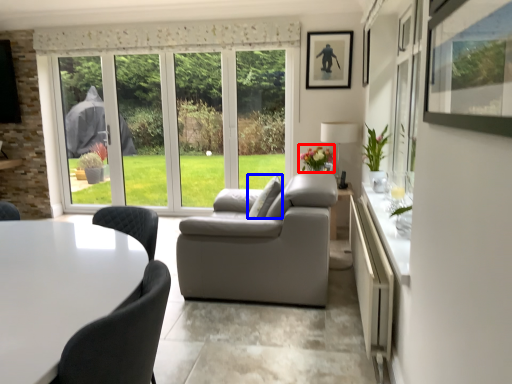
Question: Which of the following is the farthest to the observer, flower (highlighted by a red box) or pillow (highlighted by a blue box)?

Choices:
 (A) flower
 (B) pillow

Answer: (A)